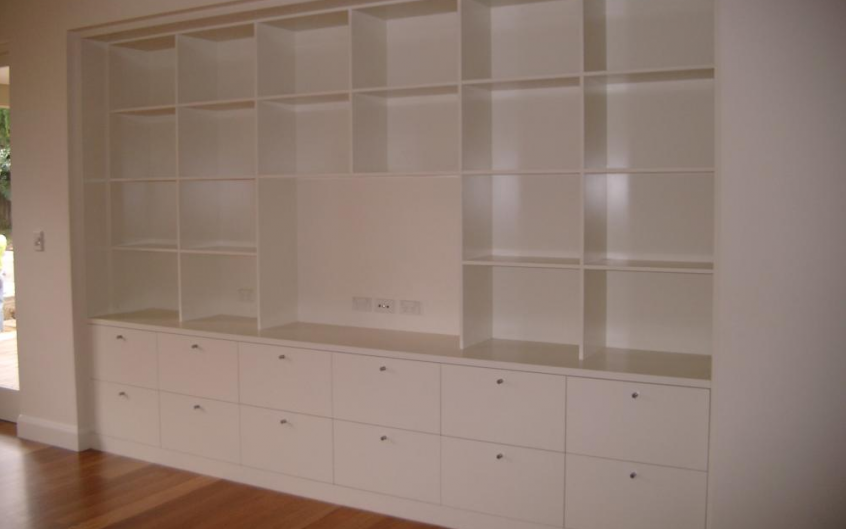
Identify the location of light switch. (36, 237).